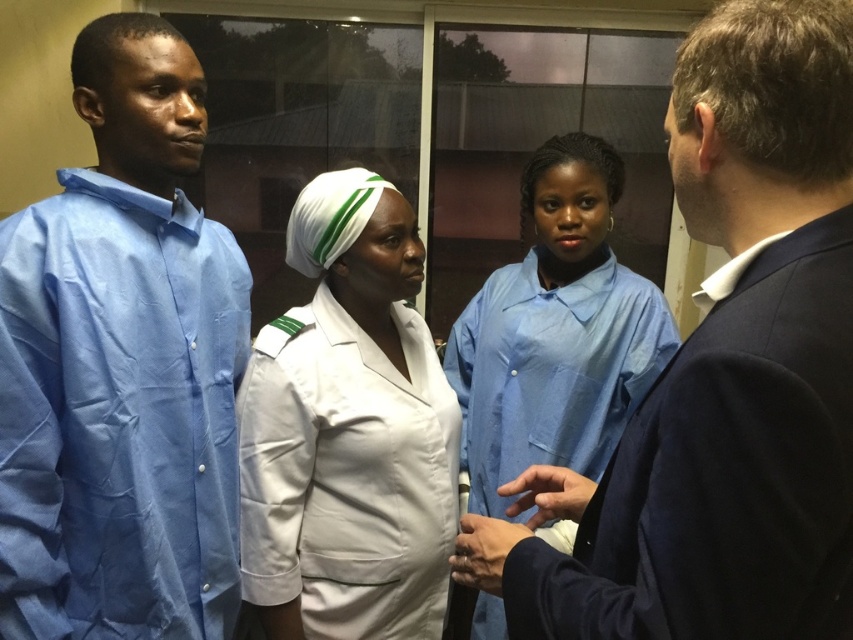
Question: Which of the following is the farthest from the observer?

Choices:
 (A) (300, 627)
 (B) (471, 460)
 (C) (595, 554)

Answer: (B)

Question: Considering the real-world distances, which object is closest to the white smooth uniform at center?

Choices:
 (A) light blue fabric shirt at left
 (B) blue cotton uniform at right
 (C) blue smooth uniform at center

Answer: (A)

Question: Is light blue fabric shirt at left bigger than blue cotton uniform at right?

Choices:
 (A) no
 (B) yes

Answer: (B)

Question: Which object is farther from the camera taking this photo?

Choices:
 (A) light blue fabric shirt at left
 (B) white smooth uniform at center

Answer: (B)

Question: Does white smooth uniform at center appear over blue smooth uniform at center?

Choices:
 (A) no
 (B) yes

Answer: (A)

Question: Is white smooth uniform at center bigger than blue smooth uniform at center?

Choices:
 (A) yes
 (B) no

Answer: (B)